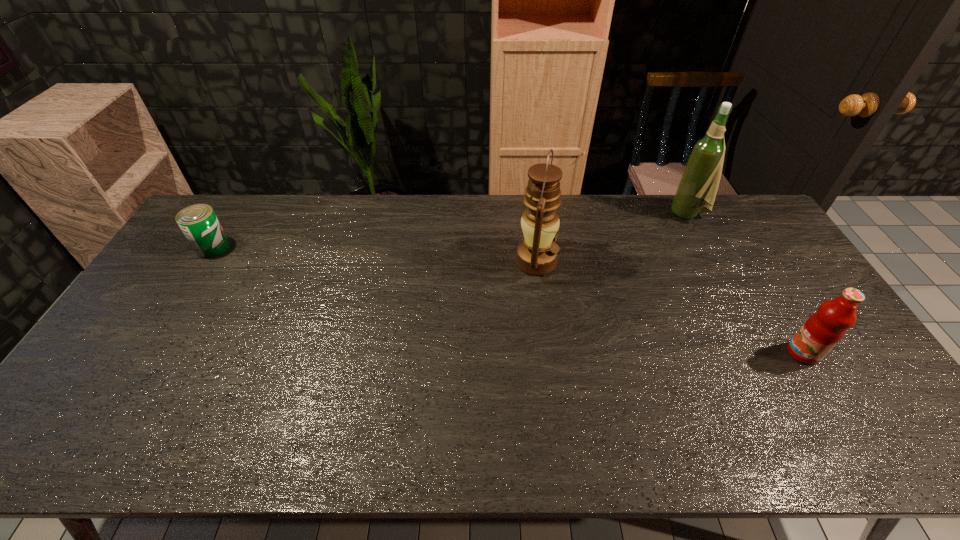
Where is `free space at the far edge of the desktop`? free space at the far edge of the desktop is located at coordinates (289, 211).

Locate an element on the screen. The width and height of the screenshot is (960, 540). free space at the near edge is located at coordinates (530, 459).

Locate an element on the screen. Image resolution: width=960 pixels, height=540 pixels. free space at the left edge is located at coordinates (184, 244).

You are a GUI agent. You are given a task and a screenshot of the screen. Output one action in this format:
    pyautogui.click(x=<x>, y=<y>)
    Task: Click on the vacant space at the right edge
    The height and width of the screenshot is (540, 960).
    Given the screenshot: What is the action you would take?
    pyautogui.click(x=799, y=305)

In the image, there is a desktop. What are the coordinates of `vacant region at the far right corner` in the screenshot? It's located at (727, 226).

Where is `free space between the oil lamp and the farthest object`? Image resolution: width=960 pixels, height=540 pixels. free space between the oil lamp and the farthest object is located at coordinates tap(612, 238).

The image size is (960, 540). I want to click on free spot between the fruit juice and the leftmost object, so click(508, 300).

Find the location of `empty location between the rightmost object and the can`. empty location between the rightmost object and the can is located at coordinates (508, 300).

Find the location of a particular element. empty space that is in between the shortest object and the second object from left to right is located at coordinates (374, 254).

This screenshot has height=540, width=960. I want to click on vacant point located between the second object from right to left and the nearest object, so click(x=745, y=284).